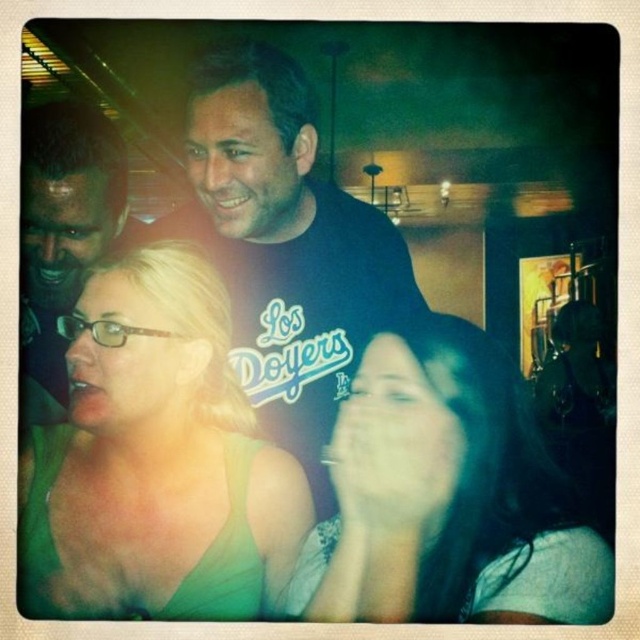
Question: Which of the following is the closest to the observer?

Choices:
 (A) matte black shirt at upper left
 (B) green fabric top at center

Answer: (B)

Question: Which point is farther to the camera?

Choices:
 (A) (147, 365)
 (B) (545, 461)

Answer: (B)

Question: Observing the image, what is the correct spatial positioning of green fabric top at center in reference to black cotton t-shirt at center?

Choices:
 (A) below
 (B) above

Answer: (A)

Question: Which of these objects is positioned farthest from the green fabric top at center?

Choices:
 (A) black cotton t-shirt at center
 (B) matte black shirt at upper left

Answer: (A)

Question: Can you confirm if green fabric top at center is positioned to the left of matte black shirt at upper left?

Choices:
 (A) no
 (B) yes

Answer: (A)

Question: Is smooth skin face at center smaller than matte black shirt at upper left?

Choices:
 (A) yes
 (B) no

Answer: (A)